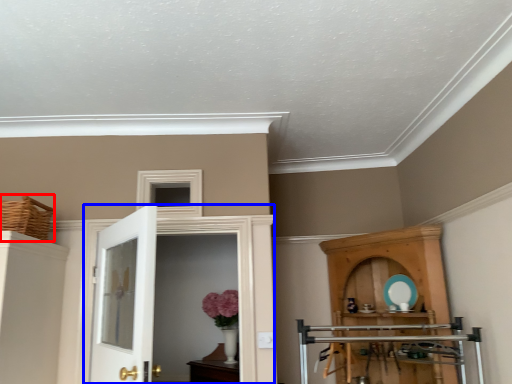
Question: Which point is closer to the camera, basket (highlighted by a red box) or door (highlighted by a blue box)?

Choices:
 (A) basket
 (B) door

Answer: (A)